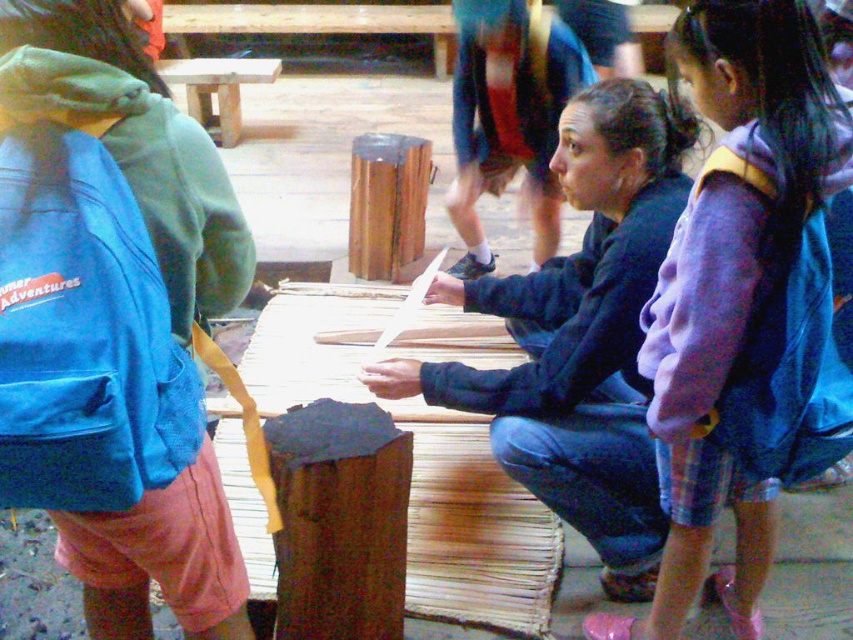
Consider the image. You are organizing a picnic and need to choose between the dark brown wood at center and the smooth brown wood at center for placing your food. Which one is more suitable based on their sizes?

The smooth brown wood at center is more suitable for placing food because it has a larger size compared to the dark brown wood at center.

You are standing at point [61,284] and want to walk to point [427,378]. Will you have to walk behind the rectangular structure to reach your destination?

Yes, since point [61,284] is in front of point [427,378], you will need to walk behind the rectangular structure to reach point [427,378].

You are trying to decide which jacket to take for your hike. You see a blue fleece jacket at left and a dark blue fleece jacket at center. Which jacket is located to the left of the other?

The blue fleece jacket at left is positioned on the left side of dark blue fleece jacket at center.